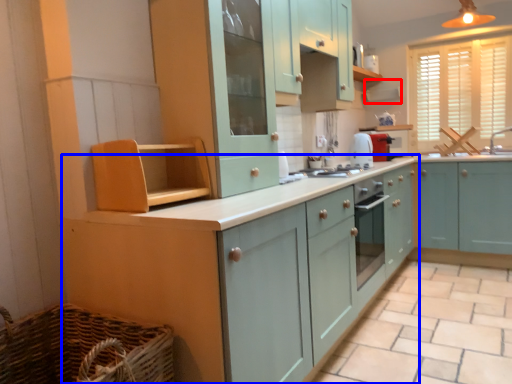
Question: Among these objects, which one is nearest to the camera, exhaust hood (highlighted by a red box) or cabinetry (highlighted by a blue box)?

Choices:
 (A) exhaust hood
 (B) cabinetry

Answer: (B)